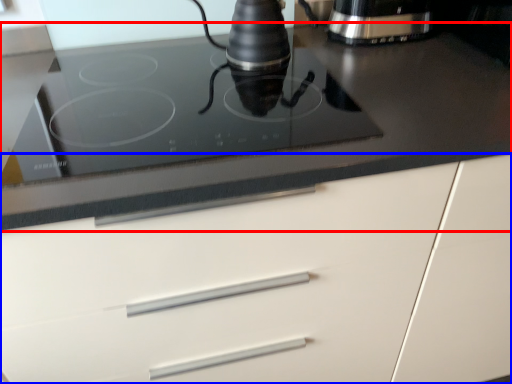
Question: Which point is further to the camera, countertop (highlighted by a red box) or cabinetry (highlighted by a blue box)?

Choices:
 (A) countertop
 (B) cabinetry

Answer: (A)